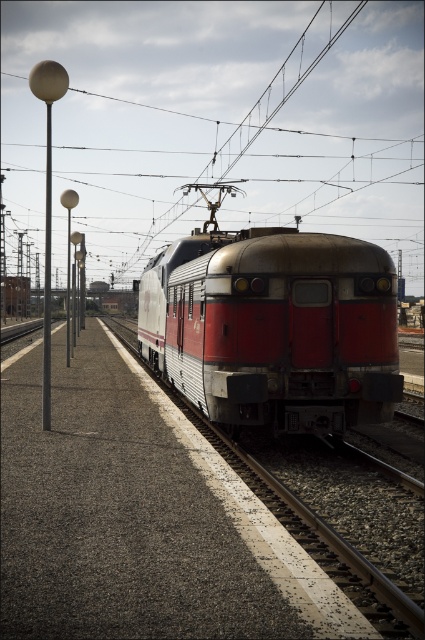
Question: Which point is farther to the camera?

Choices:
 (A) metallic pole at left
 (B) silver metallic train at center

Answer: (A)

Question: Where is silver metallic train at center located in relation to metallic pole at left in the image?

Choices:
 (A) right
 (B) left

Answer: (A)

Question: Does silver metallic train at center lie in front of metallic pole at left?

Choices:
 (A) no
 (B) yes

Answer: (B)

Question: Which of the following is the farthest from the observer?

Choices:
 (A) metallic pole at left
 (B) silver metallic train at center

Answer: (A)

Question: Which object is farther from the camera taking this photo?

Choices:
 (A) metallic pole at left
 (B) silver metallic train at center

Answer: (A)

Question: Does silver metallic train at center appear on the right side of metallic pole at left?

Choices:
 (A) no
 (B) yes

Answer: (B)